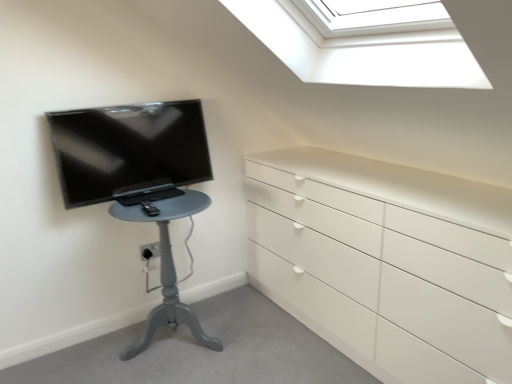
Question: Could you tell me if matte gray table at left is facing matte black tv at left?

Choices:
 (A) yes
 (B) no

Answer: (B)

Question: Is matte gray table at left located outside matte black tv at left?

Choices:
 (A) yes
 (B) no

Answer: (A)

Question: Can you confirm if matte gray table at left is bigger than matte black tv at left?

Choices:
 (A) no
 (B) yes

Answer: (B)

Question: Is matte gray table at left far away from matte black tv at left?

Choices:
 (A) yes
 (B) no

Answer: (B)

Question: Are matte gray table at left and matte black tv at left making contact?

Choices:
 (A) no
 (B) yes

Answer: (A)

Question: Can you confirm if matte gray table at left is taller than matte black tv at left?

Choices:
 (A) no
 (B) yes

Answer: (B)

Question: Considering the relative sizes of matte black tv at left and matte gray table at left in the image provided, is matte black tv at left taller than matte gray table at left?

Choices:
 (A) yes
 (B) no

Answer: (B)

Question: Would you say matte black tv at left is outside matte gray table at left?

Choices:
 (A) yes
 (B) no

Answer: (A)

Question: Does matte black tv at left have a larger size compared to matte gray table at left?

Choices:
 (A) yes
 (B) no

Answer: (B)

Question: Could you tell me if matte black tv at left is facing matte gray table at left?

Choices:
 (A) no
 (B) yes

Answer: (A)

Question: From the image's perspective, is matte black tv at left beneath matte gray table at left?

Choices:
 (A) yes
 (B) no

Answer: (B)

Question: Is matte black tv at left with matte gray table at left?

Choices:
 (A) yes
 (B) no

Answer: (B)

Question: In the image, is matte gray table at left positioned in front of or behind matte black tv at left?

Choices:
 (A) behind
 (B) front

Answer: (B)